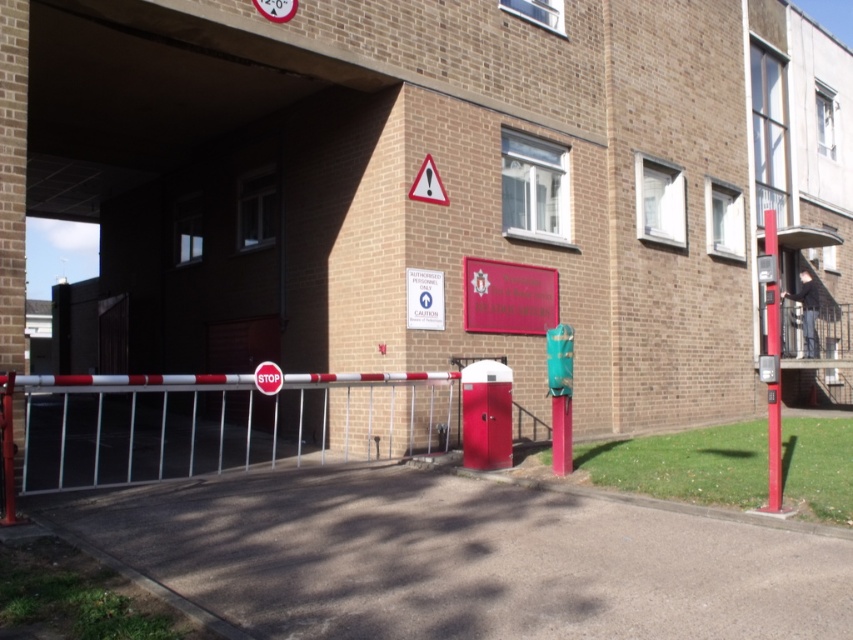
Does white paper sign at center appear under red plastic triangle at upper center?

Correct, white paper sign at center is located below red plastic triangle at upper center.

Who is lower down, white paper sign at center or red plastic triangle at upper center?

white paper sign at center

Does point (437, 289) come closer to viewer compared to point (445, 202)?

Yes, it is in front of point (445, 202).

At what (x,y) coordinates should I click in order to perform the action: click on white paper sign at center. Please return your answer as a coordinate pair (x, y). Looking at the image, I should click on (424, 298).

Does red matte sign at center appear on the right side of white paper sign at center?

Yes, red matte sign at center is to the right of white paper sign at center.

Does red matte sign at center appear over white paper sign at center?

Indeed, red matte sign at center is positioned over white paper sign at center.

Find the location of a particular element. red matte sign at center is located at coordinates (508, 298).

Who is positioned more to the left, metallic red pole at right or white paper sign at center?

From the viewer's perspective, white paper sign at center appears more on the left side.

Is metallic red pole at right behind white paper sign at center?

No, it is in front of white paper sign at center.

Who is more distant from viewer, (x=780, y=429) or (x=415, y=321)?

The point (x=780, y=429) is behind.

In order to click on metallic red pole at right in this screenshot , I will do [775, 365].